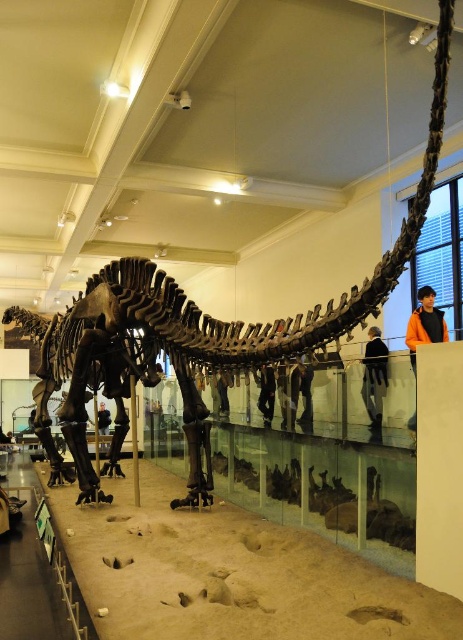
Question: Which point is closer to the camera?

Choices:
 (A) (100, 432)
 (B) (368, 364)
 (C) (424, 323)
 (D) (257, 385)

Answer: (B)

Question: Which point is closer to the camera taking this photo?

Choices:
 (A) (218, 396)
 (B) (383, 342)
 (C) (261, 396)
 (D) (97, 424)

Answer: (C)

Question: Which point is farther to the camera?

Choices:
 (A) black fabric at upper center
 (B) black fabric at lower center
 (C) orange sweater at upper right

Answer: (A)

Question: Is orange sweater at upper right to the right of black leather jacket at center from the viewer's perspective?

Choices:
 (A) yes
 (B) no

Answer: (A)

Question: Is the position of black leather jacket at center less distant than that of matte black dinosaur at lower left?

Choices:
 (A) yes
 (B) no

Answer: (A)

Question: Does black fabric at upper center appear under black leather jacket at center?

Choices:
 (A) no
 (B) yes

Answer: (A)